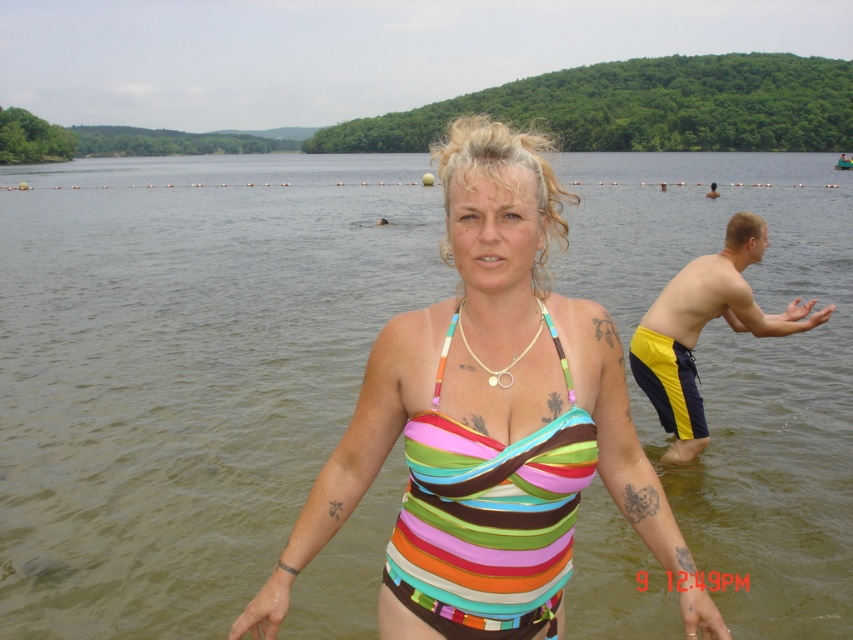
Question: Can you confirm if multicolored striped swimsuit at center is positioned to the left of multicolored fabric bikini top at center?

Choices:
 (A) no
 (B) yes

Answer: (A)

Question: Which object is closer to the camera taking this photo?

Choices:
 (A) multicolored fabric bikini top at center
 (B) multicolored striped swimsuit at center

Answer: (A)

Question: In this image, where is multicolored striped swimsuit at center located relative to multicolored fabric bikini top at center?

Choices:
 (A) right
 (B) left

Answer: (A)

Question: Where is multicolored striped swimsuit at center located in relation to multicolored fabric bikini top at center in the image?

Choices:
 (A) right
 (B) left

Answer: (A)

Question: Among these objects, which one is farthest from the camera?

Choices:
 (A) multicolored fabric bikini top at center
 (B) multicolored striped swimsuit at center

Answer: (B)

Question: Among these points, which one is nearest to the camera?

Choices:
 (A) (553, 589)
 (B) (705, 608)

Answer: (B)